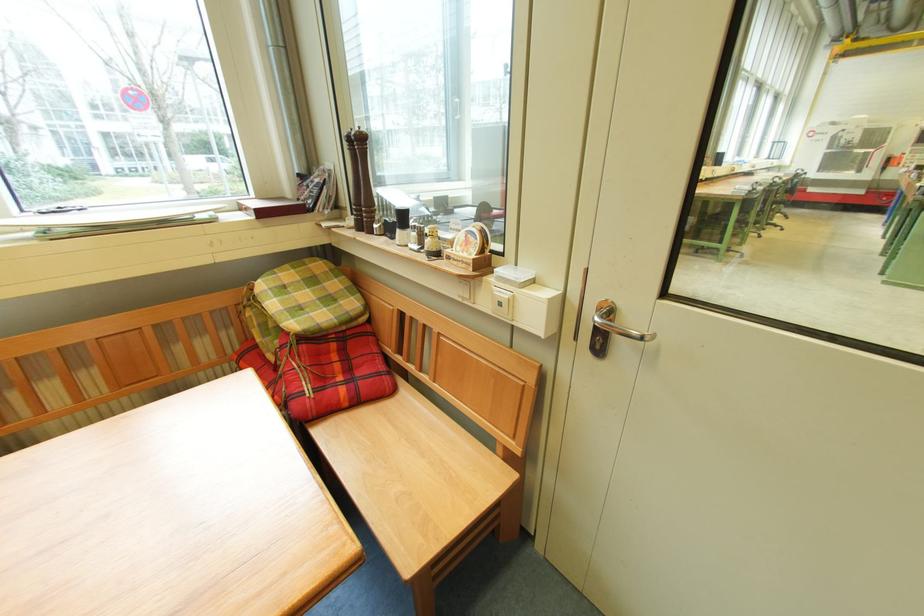
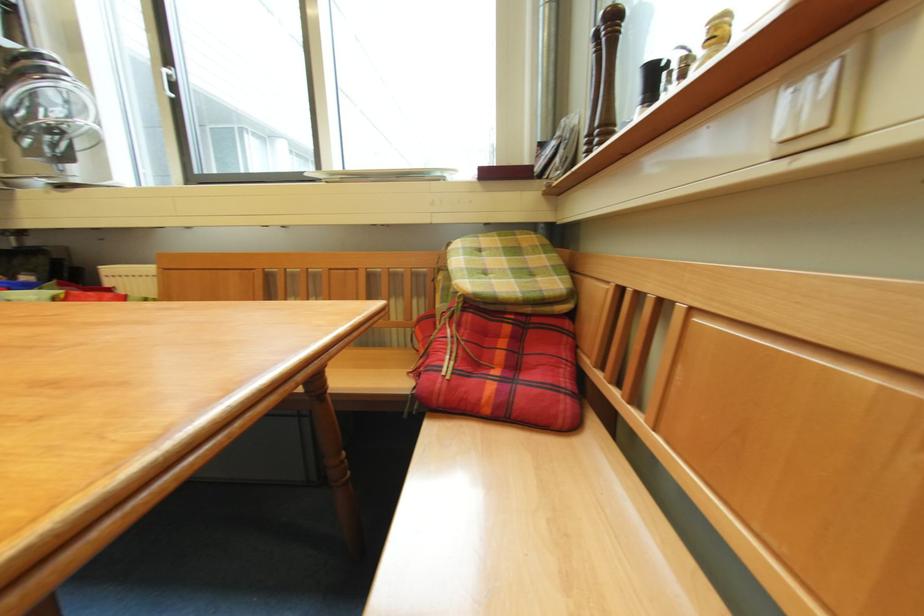
Question: The first image is from the beginning of the video and the second image is from the end. How did the camera likely rotate when shooting the video?

Choices:
 (A) Left
 (B) Right
 (C) Up
 (D) Down

Answer: (A)